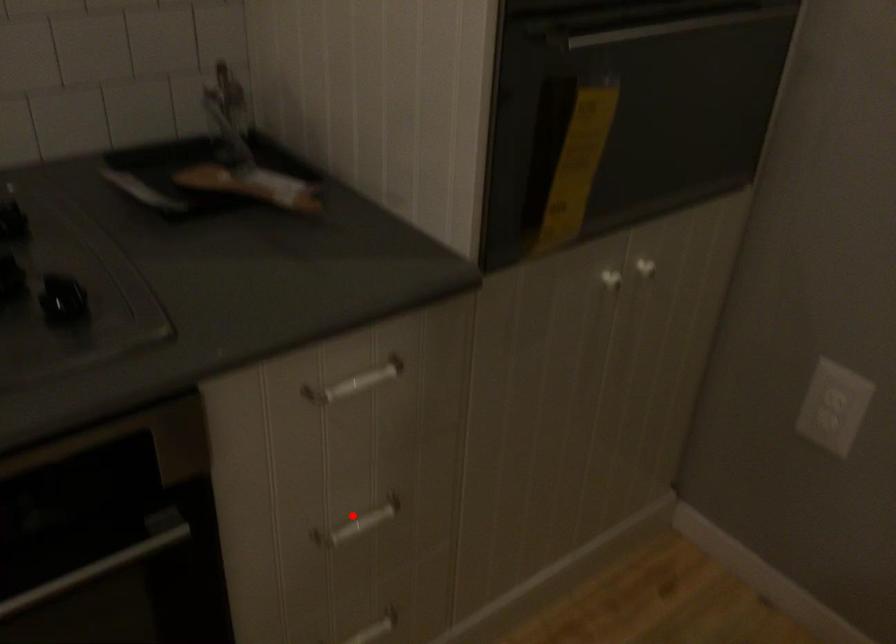
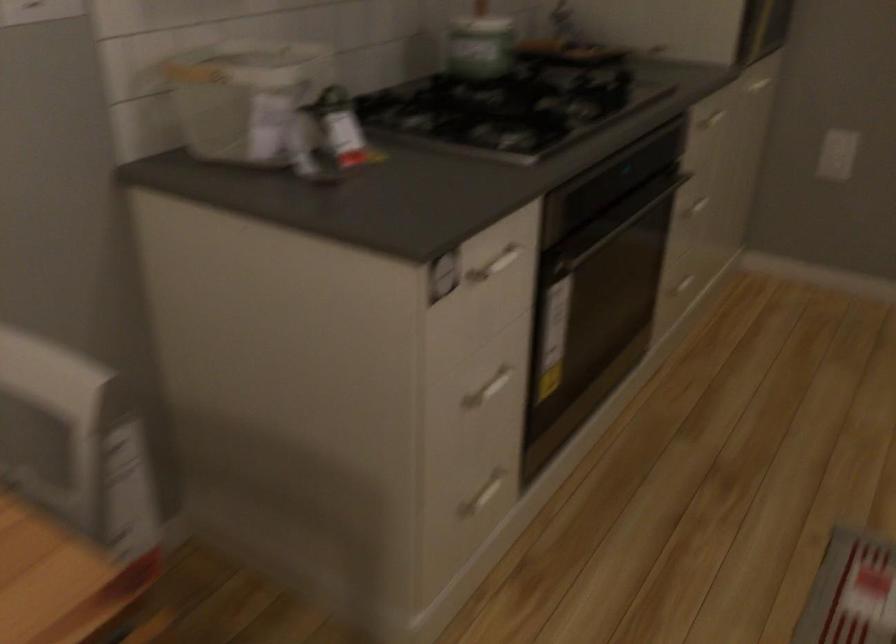
Question: I am providing you with two images of the same scene from different viewpoints. In image1, a red point is highlighted. Considering the same 3D point in image2, which of the following is correct?

Choices:
 (A) It is closer
 (B) It is farther

Answer: (B)